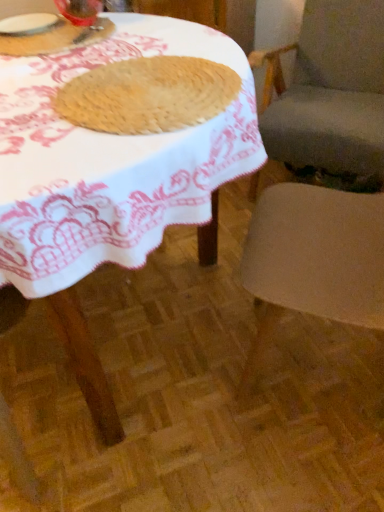
Question: From a real-world perspective, is smooth beige chair at right, which is counted as the second chair, starting from the back, on smooth beige cushion at right, the first chair in the back-to-front sequence?

Choices:
 (A) yes
 (B) no

Answer: (A)

Question: Could you tell me if smooth beige chair at right, arranged as the 1th chair when viewed from the front, is facing smooth beige cushion at right, the first chair in the back-to-front sequence?

Choices:
 (A) yes
 (B) no

Answer: (B)

Question: Does smooth beige chair at right, which is counted as the second chair, starting from the back, come behind smooth beige cushion at right, the first chair in the back-to-front sequence?

Choices:
 (A) yes
 (B) no

Answer: (B)

Question: Considering the relative positions of smooth beige chair at right, arranged as the 1th chair when viewed from the front, and smooth beige cushion at right, the first chair in the back-to-front sequence, in the image provided, is smooth beige chair at right, arranged as the 1th chair when viewed from the front, to the left of smooth beige cushion at right, the first chair in the back-to-front sequence, from the viewer's perspective?

Choices:
 (A) no
 (B) yes

Answer: (B)

Question: Is smooth beige chair at right, arranged as the 1th chair when viewed from the front, not near smooth beige cushion at right, the first chair in the back-to-front sequence?

Choices:
 (A) no
 (B) yes

Answer: (A)

Question: Is transparent glass at upper left, positioned as the second tableware in left-to-right order, wider or thinner than matte glass jar at upper left?

Choices:
 (A) wide
 (B) thin

Answer: (B)

Question: Is transparent glass at upper left, the 1th tableware from the right, taller or shorter than matte glass jar at upper left?

Choices:
 (A) tall
 (B) short

Answer: (A)

Question: Is point (64, 10) positioned closer to the camera than point (9, 49)?

Choices:
 (A) farther
 (B) closer

Answer: (A)

Question: Based on their sizes in the image, would you say transparent glass at upper left, positioned as the second tableware in left-to-right order, is bigger or smaller than matte glass jar at upper left?

Choices:
 (A) big
 (B) small

Answer: (A)

Question: Based on their sizes in the image, would you say golden brown textured cookie at center is bigger or smaller than smooth beige chair at right, arranged as the 1th chair when viewed from the front?

Choices:
 (A) big
 (B) small

Answer: (B)

Question: Considering the positions of point (173, 89) and point (374, 221), is point (173, 89) closer or farther from the camera than point (374, 221)?

Choices:
 (A) closer
 (B) farther

Answer: (A)

Question: Looking at their shapes, would you say golden brown textured cookie at center is wider or thinner than smooth beige chair at right, arranged as the 1th chair when viewed from the front?

Choices:
 (A) thin
 (B) wide

Answer: (A)

Question: Is golden brown textured cookie at center spatially inside smooth beige chair at right, which is counted as the second chair, starting from the back, or outside of it?

Choices:
 (A) outside
 (B) inside

Answer: (A)

Question: Does point (9, 36) appear closer or farther from the camera than point (281, 78)?

Choices:
 (A) farther
 (B) closer

Answer: (B)

Question: Relative to smooth beige cushion at right, which is the 2th chair in front-to-back order, is matte glass jar at upper left in front or behind?

Choices:
 (A) behind
 (B) front

Answer: (B)